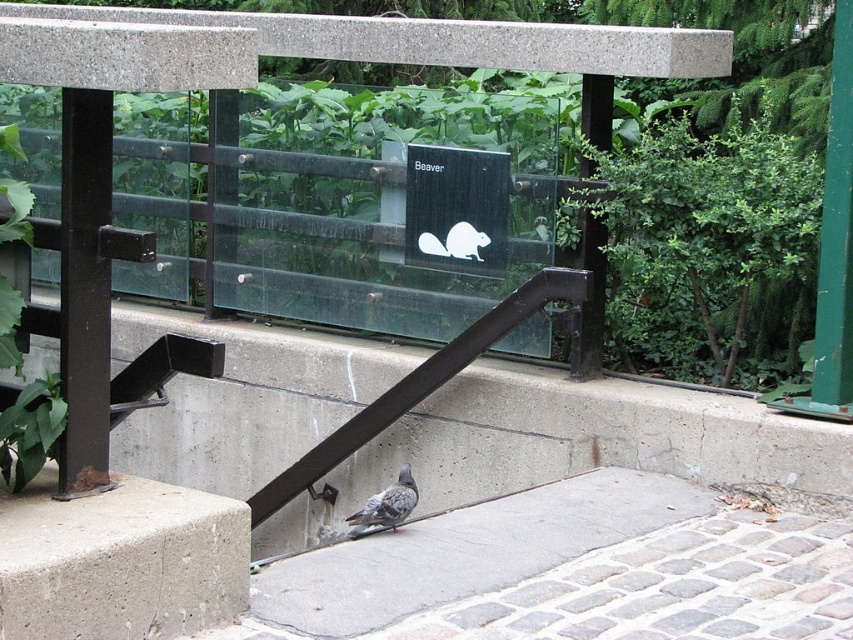
You are a zoo visitor standing on the paved walkway. You want to take a photo of the white matte beaver at center through the glass barrier. To avoid blocking the shot with your feet, you need to position yourself behind the gray concrete block at lower left. Is this possible given their positions?

The gray concrete block at lower left is to the left of the white matte beaver at center, so positioning yourself behind the gray concrete block at lower left would place you to the left of the beaver. This might not block your shot but ensure you are aligned properly to capture the white matte beaver at center through the glass barrier without obstruction from your feet.

You are a zoo visitor standing on the gray concrete sidewalk at center. You want to take a photo of the gray speckled pigeon at lower center. Is the pigeon in front of or behind the sidewalk in your view?

The gray concrete sidewalk at center is in front of the gray speckled pigeon at lower center, so the pigeon will appear behind the sidewalk in your view.

You are a zoo visitor standing at the camera position. You want to place a 2.50 meter long bench on the walkway so that it extends from the gray concrete block at lower left towards the glass barrier. Will the bench fit entirely on the walkway without overlapping the glass barrier?

The gray concrete block at lower left is 3.80 meters away from the camera. Since the bench is 2.50 meters long, placing it from the block towards the glass barrier would leave enough space as 3.80 meters minus 2.50 meters equals 1.30 meters remaining distance. Therefore, the bench will fit entirely on the walkway without overlapping the glass barrier.